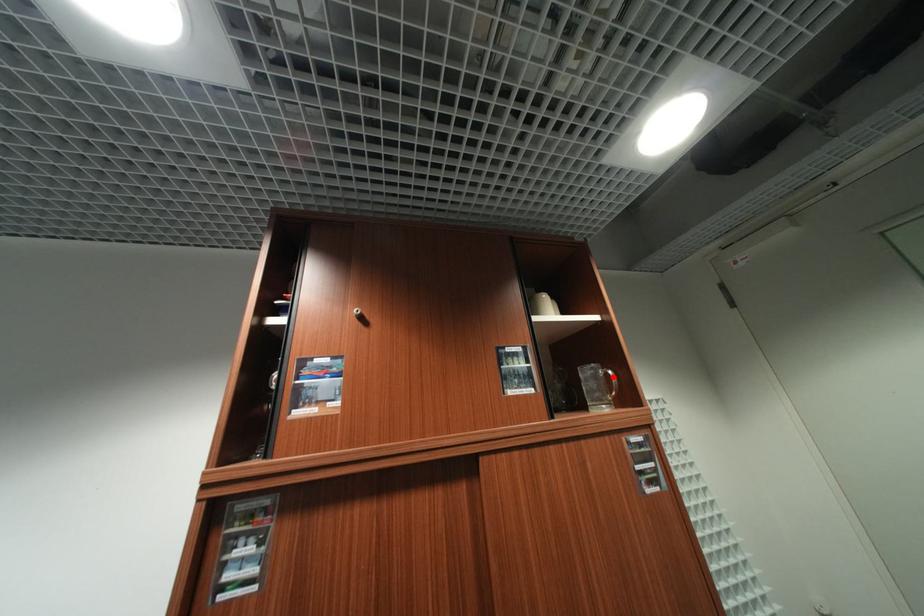
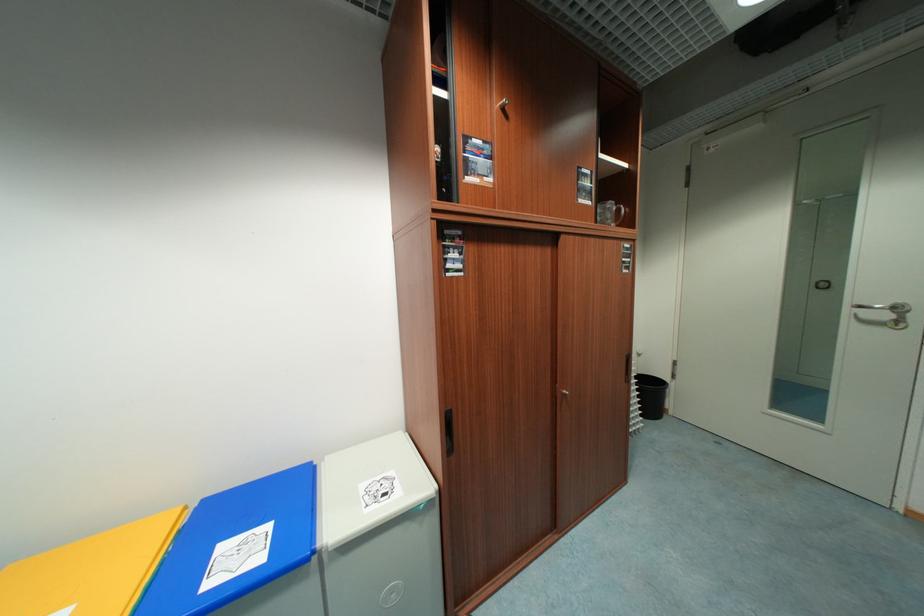
Question: I am providing you with two images of the same scene from different viewpoints. A red point is shown in image1. For the corresponding object point in image2, is it positioned nearer or farther from the camera?

Choices:
 (A) Nearer
 (B) Farther

Answer: (A)